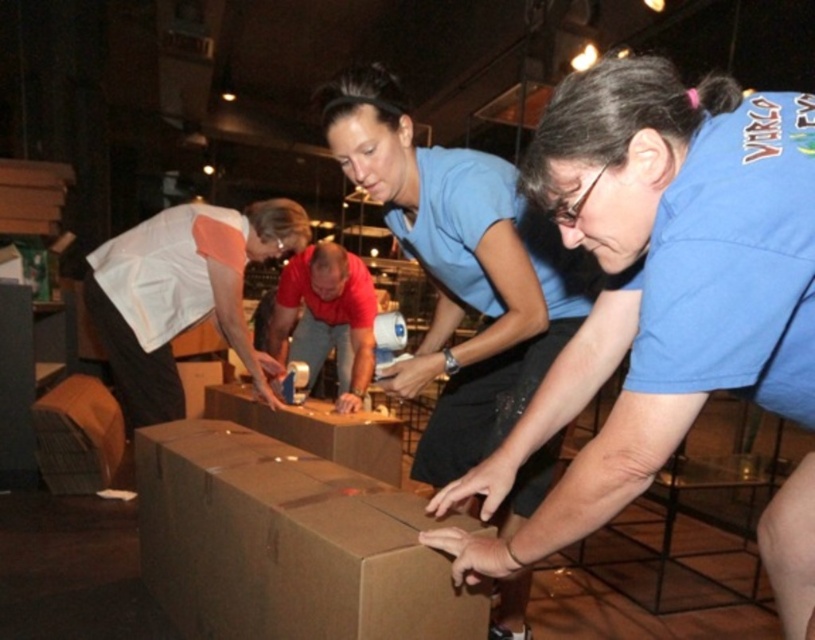
This screenshot has height=640, width=815. Describe the element at coordinates (183, 294) in the screenshot. I see `white matte shirt at upper left` at that location.

Does white matte shirt at upper left appear under red fabric shirt at center?

Incorrect, white matte shirt at upper left is not positioned below red fabric shirt at center.

At what (x,y) coordinates should I click in order to perform the action: click on white matte shirt at upper left. Please return your answer as a coordinate pair (x, y). Image resolution: width=815 pixels, height=640 pixels. Looking at the image, I should click on tap(183, 294).

You are a GUI agent. You are given a task and a screenshot of the screen. Output one action in this format:
    pyautogui.click(x=<x>, y=<y>)
    Task: Click on the white matte shirt at upper left
    
    Given the screenshot: What is the action you would take?
    pyautogui.click(x=183, y=294)

What do you see at coordinates (183, 294) in the screenshot? I see `white matte shirt at upper left` at bounding box center [183, 294].

Between white matte shirt at upper left and brown cardboard at center, which one has more height?

With more height is white matte shirt at upper left.

Describe the element at coordinates (183, 294) in the screenshot. I see `white matte shirt at upper left` at that location.

You are a GUI agent. You are given a task and a screenshot of the screen. Output one action in this format:
    pyautogui.click(x=<x>, y=<y>)
    Task: Click on the white matte shirt at upper left
    The image size is (815, 640).
    Given the screenshot: What is the action you would take?
    pyautogui.click(x=183, y=294)

Does blue matte shirt at center appear on the right side of red fabric shirt at center?

Yes, blue matte shirt at center is to the right of red fabric shirt at center.

Who is higher up, blue matte shirt at center or red fabric shirt at center?

Positioned higher is red fabric shirt at center.

This screenshot has width=815, height=640. What are the coordinates of `blue matte shirt at center` in the screenshot? It's located at (460, 269).